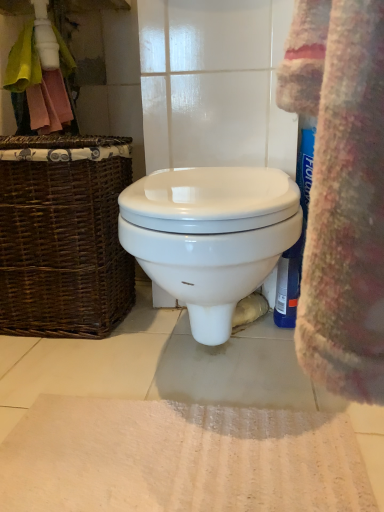
This screenshot has width=384, height=512. What do you see at coordinates (180, 458) in the screenshot?
I see `white textured bath mat at lower center` at bounding box center [180, 458].

The height and width of the screenshot is (512, 384). I want to click on brown wicker picnic basket at left, so click(63, 234).

From the image's perspective, is brown wicker picnic basket at left under white textured bath mat at lower center?

Actually, brown wicker picnic basket at left appears above white textured bath mat at lower center in the image.

Consider the image. Is brown wicker picnic basket at left in front of or behind white textured bath mat at lower center in the image?

Visually, brown wicker picnic basket at left is located behind white textured bath mat at lower center.

Is brown wicker picnic basket at left not close to white textured bath mat at lower center?

They are positioned close to each other.

Which object is positioned more to the left, brown wicker picnic basket at left or white textured bath mat at lower center?

From the viewer's perspective, brown wicker picnic basket at left appears more on the left side.

Between point (239, 494) and point (20, 190), which one is positioned behind?

The point (20, 190) is farther from the camera.

Who is smaller, white textured bath mat at lower center or brown wicker picnic basket at left?

white textured bath mat at lower center is smaller.

Is white textured bath mat at lower center aimed at brown wicker picnic basket at left?

No.

From the image's perspective, is white textured bath mat at lower center below brown wicker picnic basket at left?

Correct, white textured bath mat at lower center appears lower than brown wicker picnic basket at left in the image.

Is white glossy toilet at center positioned far away from white textured bath mat at lower center?

white glossy toilet at center is actually quite close to white textured bath mat at lower center.

Is white glossy toilet at center positioned in front of white textured bath mat at lower center?

No.

Is white textured bath mat at lower center at the back of white glossy toilet at center?

No, white glossy toilet at center is not facing the opposite direction of white textured bath mat at lower center.

Locate an element on the screen. Image resolution: width=384 pixels, height=512 pixels. bath mat located below the white glossy toilet at center (from the image's perspective) is located at coordinates (180, 458).

Can white glossy toilet at center be found inside white textured bath mat at lower center?

No, white glossy toilet at center is not inside white textured bath mat at lower center.

Are white textured bath mat at lower center and white glossy toilet at center located far from each other?

white textured bath mat at lower center is actually quite close to white glossy toilet at center.

Considering the relative positions of white textured bath mat at lower center and white glossy toilet at center in the image provided, is white textured bath mat at lower center behind white glossy toilet at center?

No, white textured bath mat at lower center is closer to the viewer.

Which of these two, white textured bath mat at lower center or white glossy toilet at center, is smaller?

With smaller size is white textured bath mat at lower center.

Is the surface of brown wicker picnic basket at left in direct contact with white glossy toilet at center?

There is a gap between brown wicker picnic basket at left and white glossy toilet at center.

From the image's perspective, is brown wicker picnic basket at left beneath white glossy toilet at center?

No.

Considering the positions of objects brown wicker picnic basket at left and white glossy toilet at center in the image provided, who is more to the right, brown wicker picnic basket at left or white glossy toilet at center?

white glossy toilet at center.

Considering the relative sizes of brown wicker picnic basket at left and white glossy toilet at center in the image provided, is brown wicker picnic basket at left taller than white glossy toilet at center?

Yes, brown wicker picnic basket at left is taller than white glossy toilet at center.

You are a GUI agent. You are given a task and a screenshot of the screen. Output one action in this format:
    pyautogui.click(x=<x>, y=<y>)
    Task: Click on the picnic basket located above the white glossy toilet at center (from the image's perspective)
    
    Given the screenshot: What is the action you would take?
    pyautogui.click(x=63, y=234)

Can you tell me how much white glossy toilet at center and brown wicker picnic basket at left differ in facing direction?

0.327 degrees separate the facing orientations of white glossy toilet at center and brown wicker picnic basket at left.

From their relative heights in the image, would you say white glossy toilet at center is taller or shorter than brown wicker picnic basket at left?

white glossy toilet at center is shorter than brown wicker picnic basket at left.

Is white glossy toilet at center next to brown wicker picnic basket at left?

No, white glossy toilet at center is not touching brown wicker picnic basket at left.

Where is `bath mat in front of the brown wicker picnic basket at left`? This screenshot has height=512, width=384. bath mat in front of the brown wicker picnic basket at left is located at coordinates (180, 458).

You are a GUI agent. You are given a task and a screenshot of the screen. Output one action in this format:
    pyautogui.click(x=<x>, y=<y>)
    Task: Click on the picnic basket above the white textured bath mat at lower center (from the image's perspective)
    This screenshot has width=384, height=512.
    Given the screenshot: What is the action you would take?
    pyautogui.click(x=63, y=234)

Based on their spatial positions, is white glossy toilet at center or white textured bath mat at lower center further from brown wicker picnic basket at left?

white textured bath mat at lower center is further to brown wicker picnic basket at left.

Looking at the image, which one is located further to white textured bath mat at lower center, brown wicker picnic basket at left or white glossy toilet at center?

The object further to white textured bath mat at lower center is brown wicker picnic basket at left.

Looking at the image, which one is located further to brown wicker picnic basket at left, white textured bath mat at lower center or white glossy toilet at center?

white textured bath mat at lower center is further to brown wicker picnic basket at left.

Considering their positions, is white glossy toilet at center positioned closer to white textured bath mat at lower center than brown wicker picnic basket at left?

white glossy toilet at center is closer to white textured bath mat at lower center.

Estimate the real-world distances between objects in this image. Which object is closer to white glossy toilet at center, white textured bath mat at lower center or brown wicker picnic basket at left?

brown wicker picnic basket at left lies closer to white glossy toilet at center than the other object.

Estimate the real-world distances between objects in this image. Which object is further from white glossy toilet at center, brown wicker picnic basket at left or white textured bath mat at lower center?

white textured bath mat at lower center lies further to white glossy toilet at center than the other object.

Identify the location of bath mat situated between brown wicker picnic basket at left and white glossy toilet at center from left to right. (180, 458).